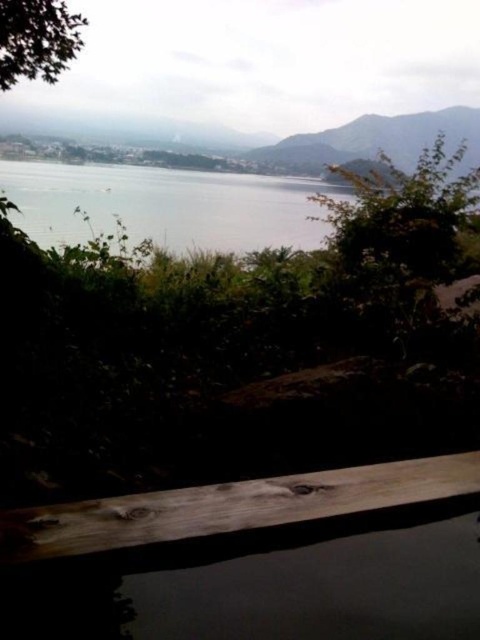
Who is higher up, brown wood rail at lower center or clear water at center?

clear water at center is above.

Is brown wood rail at lower center to the right of clear water at center from the viewer's perspective?

Correct, you'll find brown wood rail at lower center to the right of clear water at center.

Describe the element at coordinates (244, 509) in the screenshot. I see `brown wood rail at lower center` at that location.

Where is `brown wood rail at lower center`? The image size is (480, 640). brown wood rail at lower center is located at coordinates (244, 509).